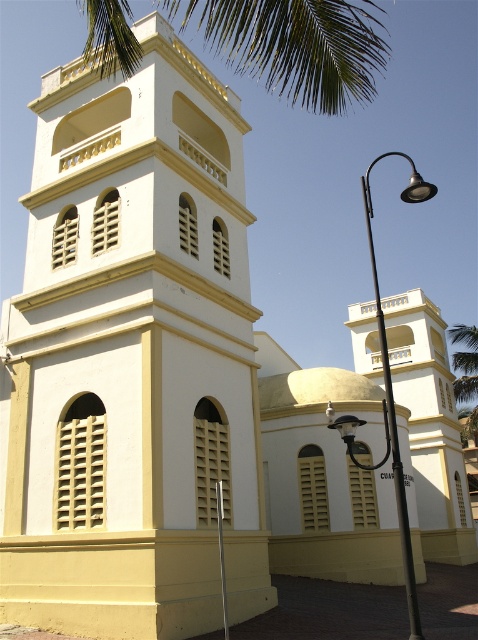
Question: Is black metal streetlight at center to the right of green leafy palm tree at upper right from the viewer's perspective?

Choices:
 (A) no
 (B) yes

Answer: (A)

Question: Where is white matte tower at center located in relation to black metal streetlight at center in the image?

Choices:
 (A) left
 (B) right

Answer: (A)

Question: Which point is farther to the camera?

Choices:
 (A) green leafy palm tree at upper right
 (B) white matte tower at center

Answer: (A)

Question: Which is farther from the black metal streetlight at center?

Choices:
 (A) green leafy palm at upper center
 (B) green leafy palm tree at upper right

Answer: (A)

Question: Among these points, which one is nearest to the camera?

Choices:
 (A) (459, 390)
 (B) (366, 216)
 (C) (455, 436)

Answer: (C)

Question: Is black metal streetlight at center further to the viewer compared to green leafy palm tree at upper right?

Choices:
 (A) no
 (B) yes

Answer: (A)